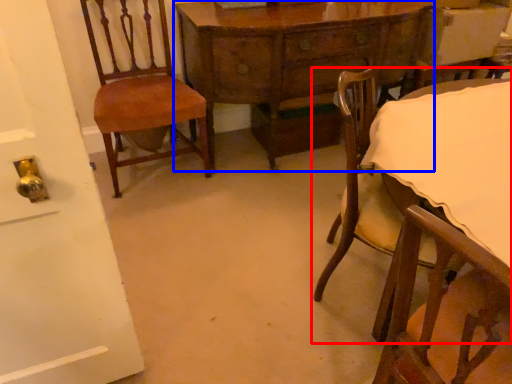
Question: Among these objects, which one is nearest to the camera, chair (highlighted by a red box) or table (highlighted by a blue box)?

Choices:
 (A) chair
 (B) table

Answer: (A)